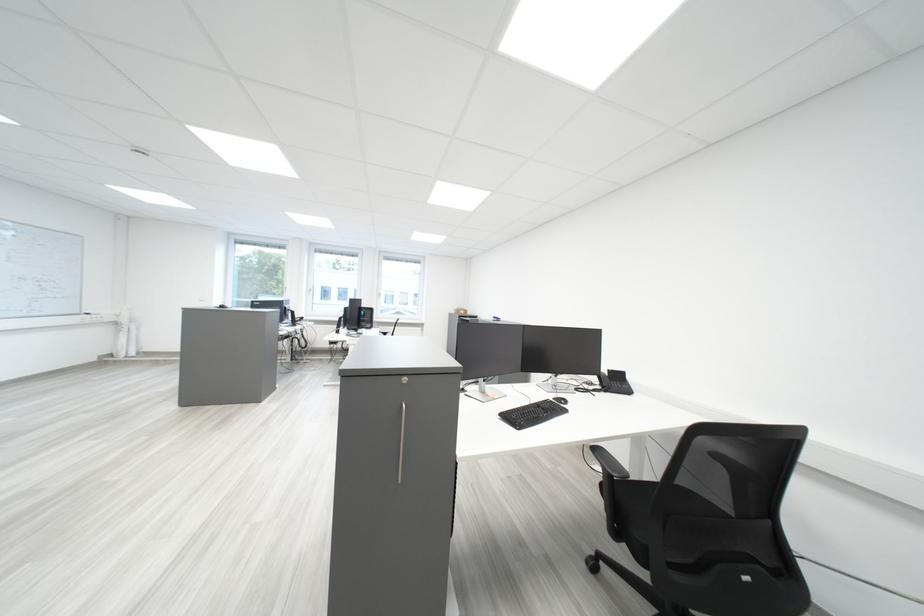
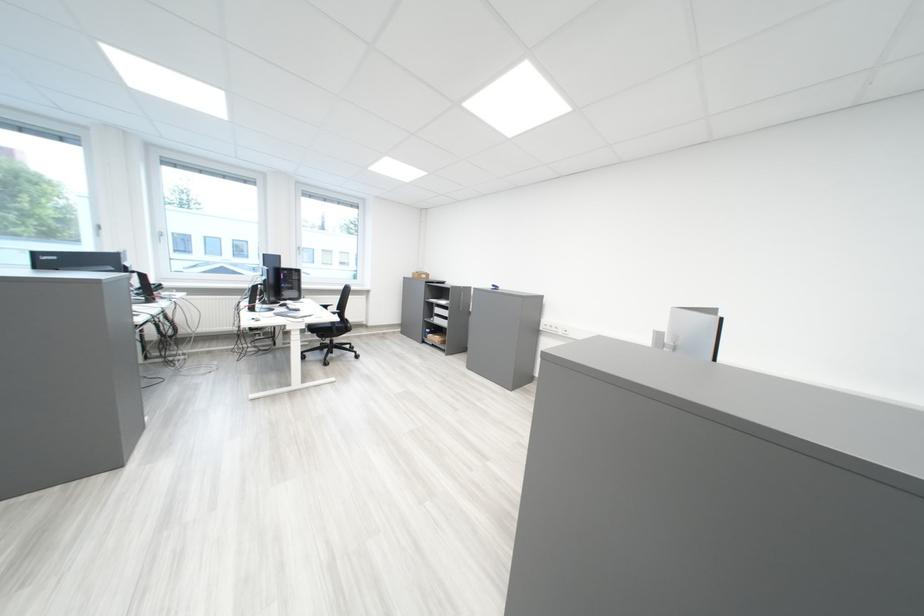
In a continuous first-person perspective shot, in which direction is the camera moving?

The cameraman walked toward left, forward.